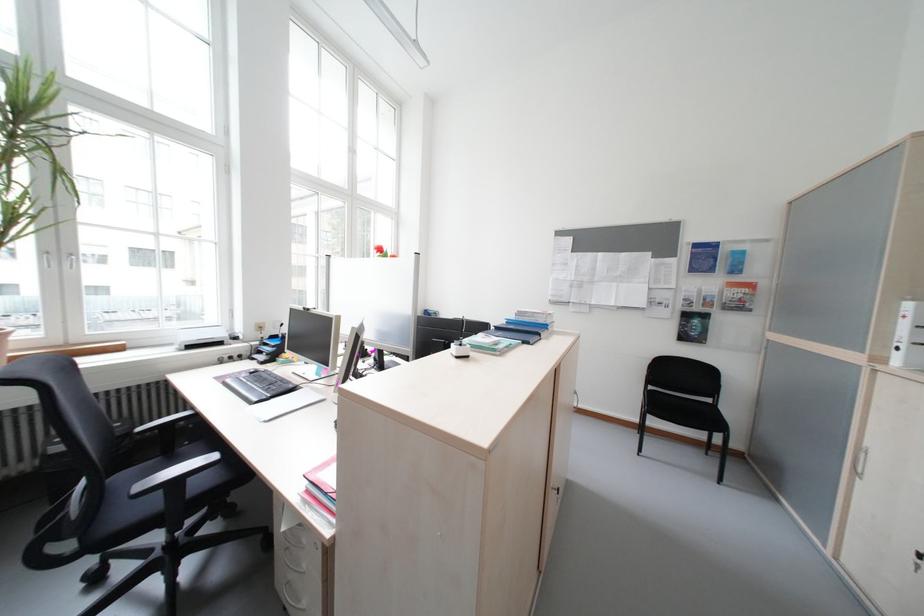
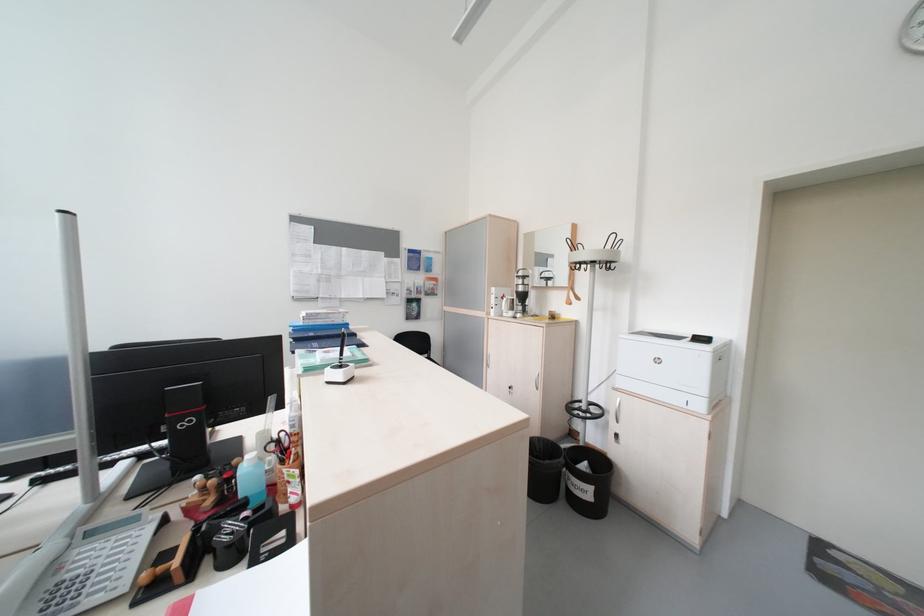
Question: Based on the continuous images, in which direction is the camera rotating? Reply with the corresponding letter.

Choices:
 (A) Left
 (B) Right
 (C) Up
 (D) Down

Answer: (B)